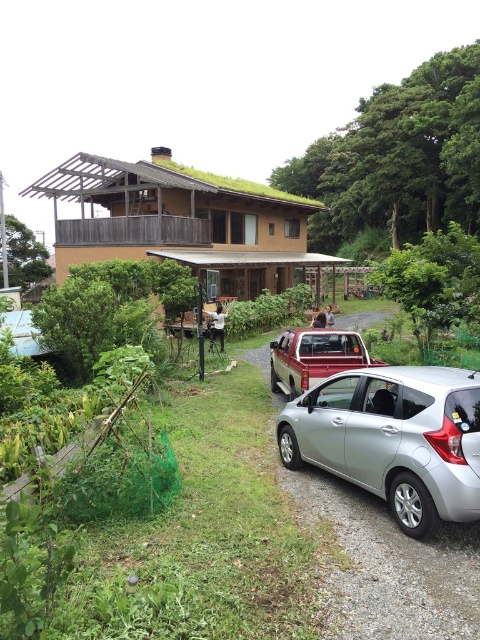
Question: Does metallic silver car at lower center have a greater width compared to silver metallic sedan at center?

Choices:
 (A) no
 (B) yes

Answer: (B)

Question: Based on their relative distances, which object is nearer to the silver metallic sedan at center?

Choices:
 (A) silver metallic car at lower right
 (B) metallic silver car at lower center

Answer: (B)

Question: Can you confirm if silver metallic car at lower right is positioned to the left of silver metallic sedan at center?

Choices:
 (A) yes
 (B) no

Answer: (B)

Question: Which object is closer to the camera taking this photo?

Choices:
 (A) metallic silver car at lower center
 (B) silver metallic sedan at center
 (C) silver metallic car at lower right

Answer: (A)

Question: Is silver metallic car at lower right thinner than silver metallic sedan at center?

Choices:
 (A) no
 (B) yes

Answer: (B)

Question: Which point appears closest to the camera in this image?

Choices:
 (A) (406, 563)
 (B) (455, 384)
 (C) (349, 348)

Answer: (A)